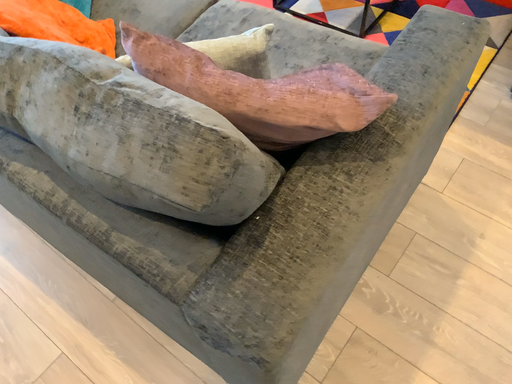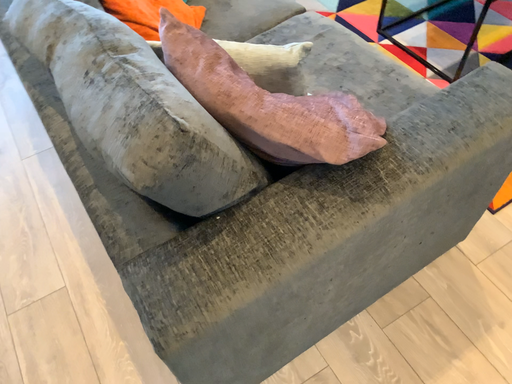
Question: Which way did the camera rotate in the video?

Choices:
 (A) rotated right
 (B) rotated left

Answer: (B)